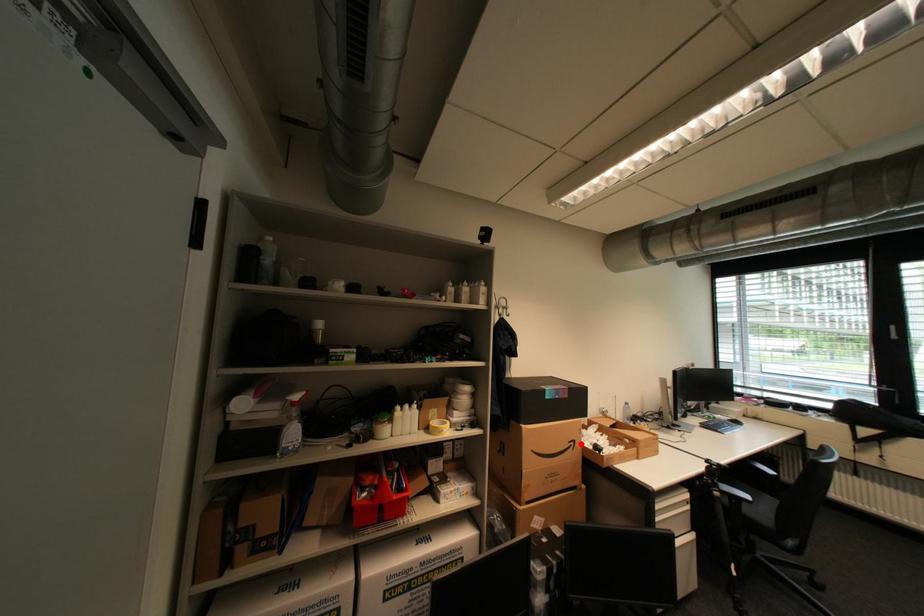
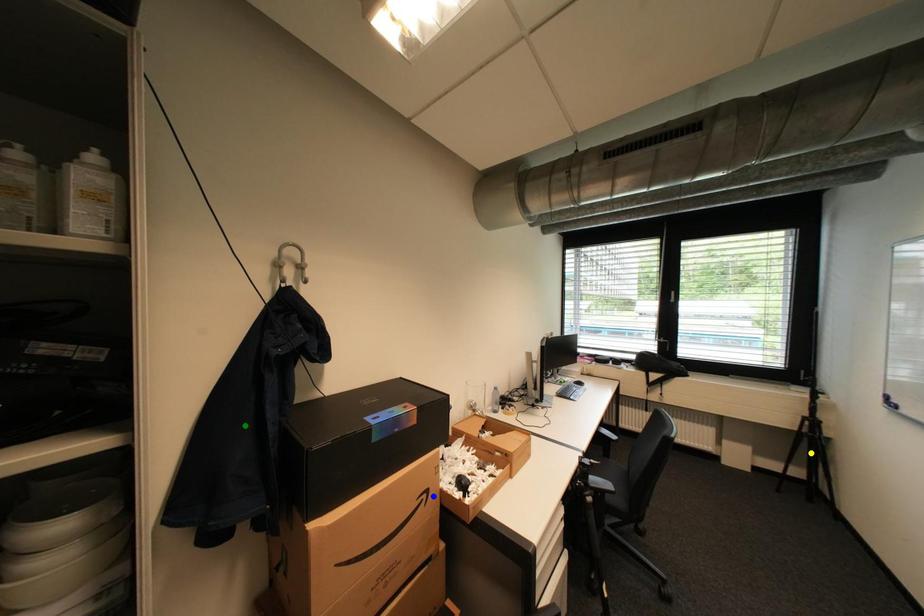
Question: I am providing you with two images of the same scene from different viewpoints. A red point is marked on the first image. You are given multiple points on the second image. In image 2, which mark is for the same physical point as the one in image 1?

Choices:
 (A) blue point
 (B) yellow point
 (C) green point

Answer: (A)